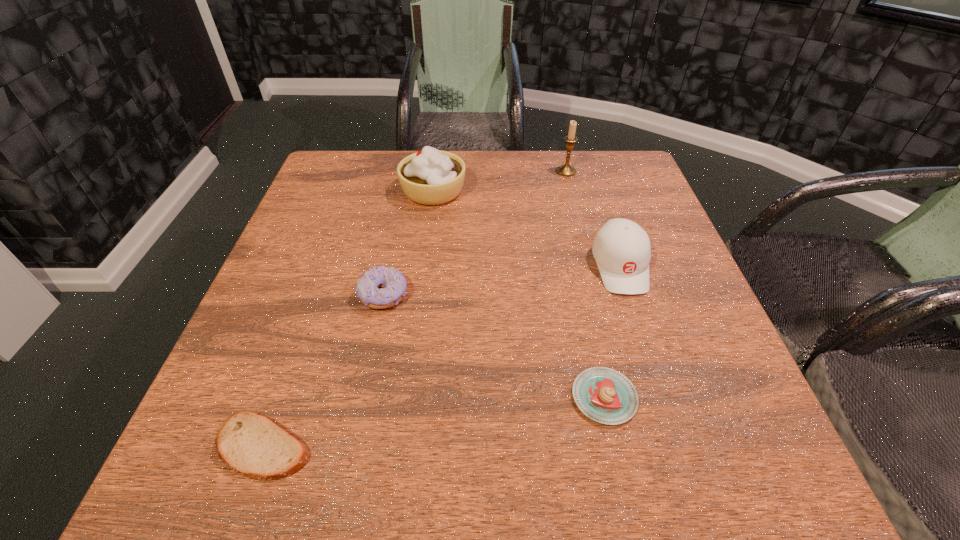
Identify the location of free space located on the front of the doughnut. (352, 443).

I want to click on free location located 0.110m on the left of the fifth tallest object, so click(x=506, y=397).

Locate an element on the screen. This screenshot has width=960, height=540. blank space located 0.220m on the right of the shortest object is located at coordinates (456, 446).

Locate an element on the screen. The width and height of the screenshot is (960, 540). candle holder that is at the far edge is located at coordinates (566, 170).

Where is `whipped cream situated at the far edge`? This screenshot has height=540, width=960. whipped cream situated at the far edge is located at coordinates (430, 177).

Find the location of a particular element. The height and width of the screenshot is (540, 960). object at the near edge is located at coordinates (250, 444).

Find the location of a particular element. This screenshot has height=540, width=960. object positioned at the left edge is located at coordinates pyautogui.click(x=250, y=444).

The image size is (960, 540). Identify the location of object positioned at the right edge. (621, 248).

In order to click on object that is at the near left corner in this screenshot , I will do `click(250, 444)`.

In the image, there is a desktop. Find the location of `vacant space at the far edge`. vacant space at the far edge is located at coordinates (485, 180).